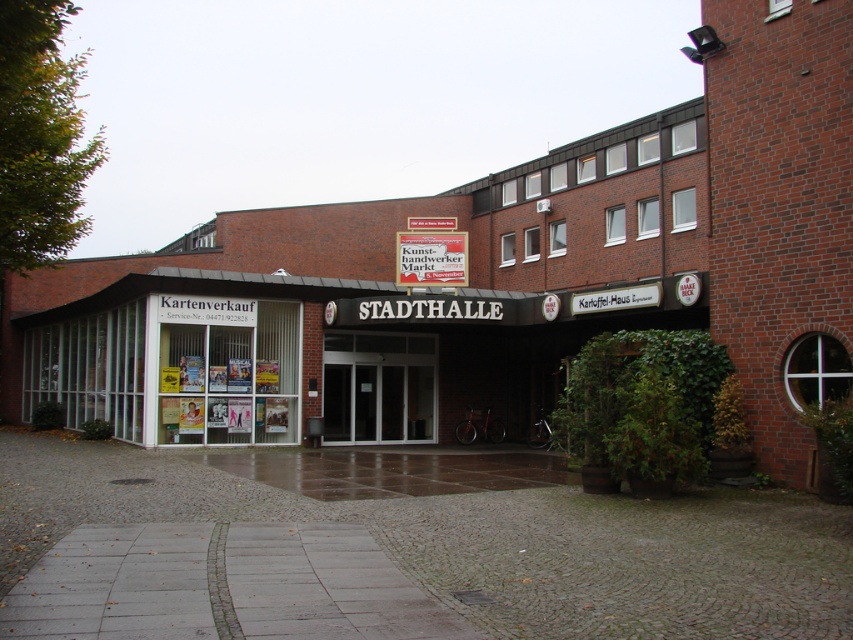
Question: Is gray cobblestone pavement at center thinner than white glass storefront at center?

Choices:
 (A) no
 (B) yes

Answer: (B)

Question: Can you confirm if gray cobblestone pavement at center is smaller than transparent glass door at center?

Choices:
 (A) no
 (B) yes

Answer: (A)

Question: Considering the real-world distances, which object is closest to the white glass storefront at center?

Choices:
 (A) gray cobblestone pavement at center
 (B) red cardboard sign at center

Answer: (B)

Question: Is gray cobblestone pavement at center closer to the viewer compared to red cardboard sign at center?

Choices:
 (A) yes
 (B) no

Answer: (A)

Question: Based on their relative distances, which object is nearer to the red cardboard sign at center?

Choices:
 (A) white glass storefront at center
 (B) gray cobblestone pavement at center
 (C) transparent glass door at center

Answer: (C)

Question: Estimate the real-world distances between objects in this image. Which object is farther from the white glass storefront at center?

Choices:
 (A) gray cobblestone pavement at center
 (B) transparent glass door at center
 (C) red cardboard sign at center

Answer: (A)